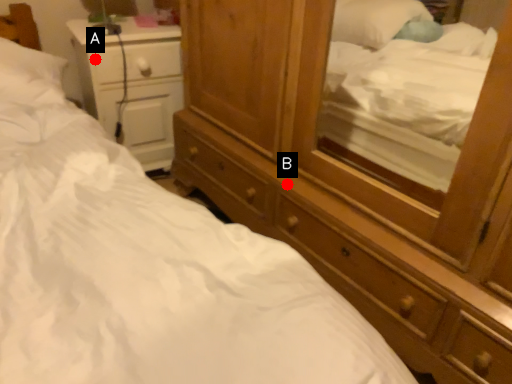
Question: Two points are circled on the image, labeled by A and B beside each circle. Which of the following is the farthest from the observer?

Choices:
 (A) A is further
 (B) B is further

Answer: (A)